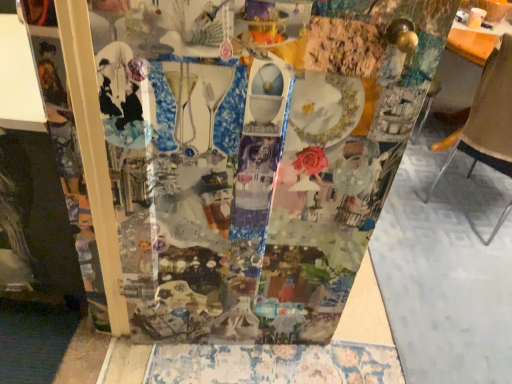
Where is `brown leather chair at right`? brown leather chair at right is located at coordinates (489, 116).

Image resolution: width=512 pixels, height=384 pixels. Describe the element at coordinates (489, 116) in the screenshot. I see `brown leather chair at right` at that location.

Where is `brown leather chair at right`? Image resolution: width=512 pixels, height=384 pixels. brown leather chair at right is located at coordinates coord(489,116).